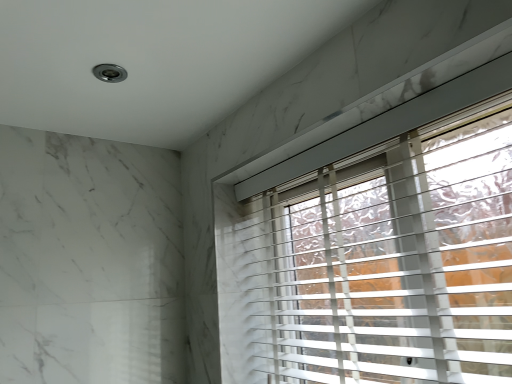
Measure the distance between white plastic blinds at upper right and camera.

white plastic blinds at upper right and camera are 31.26 inches apart.

Image resolution: width=512 pixels, height=384 pixels. What do you see at coordinates (392, 261) in the screenshot?
I see `white plastic blinds at upper right` at bounding box center [392, 261].

This screenshot has height=384, width=512. Identify the location of white plastic blinds at upper right. (392, 261).

Where is `white plastic blinds at upper right`? white plastic blinds at upper right is located at coordinates (392, 261).